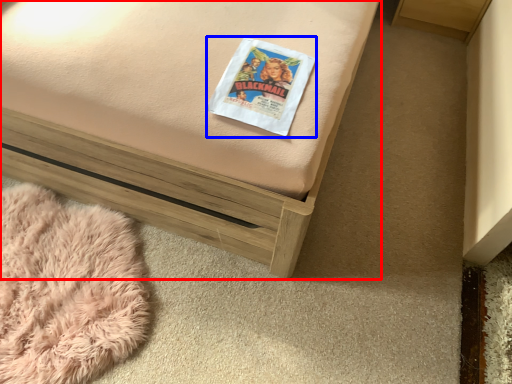
Question: Which object appears closest to the camera in this image, furniture (highlighted by a red box) or paperback book (highlighted by a blue box)?

Choices:
 (A) furniture
 (B) paperback book

Answer: (A)